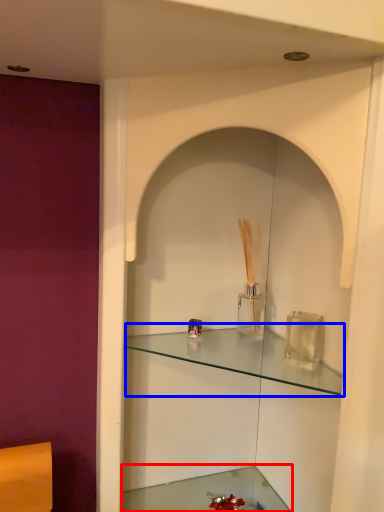
Question: Which point is further to the camera, cabinetry (highlighted by a red box) or shelf (highlighted by a blue box)?

Choices:
 (A) cabinetry
 (B) shelf

Answer: (A)